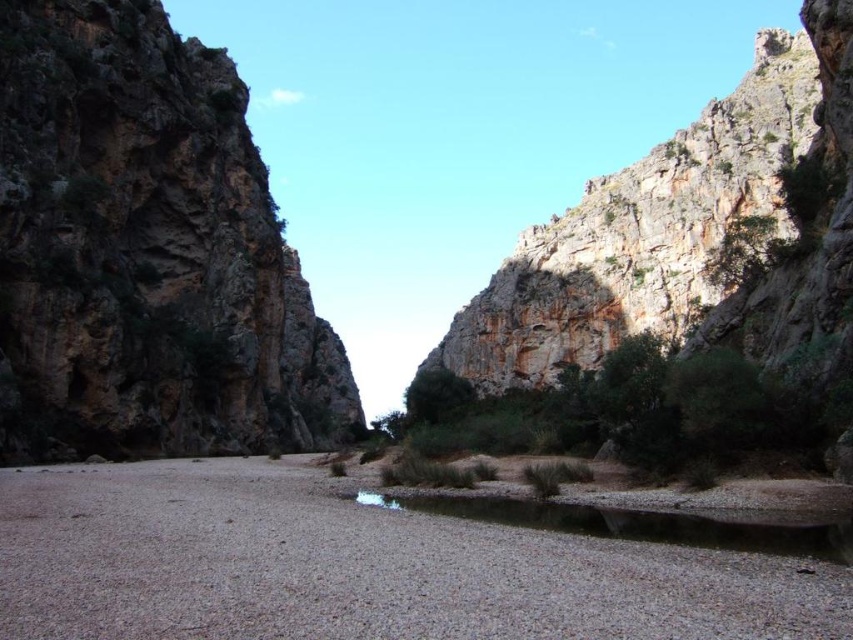
Is point (248, 579) more distant than point (735, 529)?

No.

Is gray gravel bed at center shorter than clear gravel river at center?

Incorrect, gray gravel bed at center's height does not fall short of clear gravel river at center's.

Who is more forward, (x=490, y=557) or (x=584, y=508)?

Point (x=490, y=557) is in front.

The image size is (853, 640). What are the coordinates of `gray gravel bed at center` in the screenshot? It's located at (357, 566).

Which is above, rugged rock mountain at upper right or clear gravel river at center?

rugged rock mountain at upper right is higher up.

Is rugged rock mountain at upper right closer to camera compared to clear gravel river at center?

No.

You are a GUI agent. You are given a task and a screenshot of the screen. Output one action in this format:
    pyautogui.click(x=<x>, y=<y>)
    Task: Click on the rugged rock mountain at upper right
    
    Given the screenshot: What is the action you would take?
    pyautogui.click(x=639, y=234)

In order to click on rugged rock mountain at upper right in this screenshot , I will do `click(639, 234)`.

Which is below, rustic rock mountain at left or rugged rock mountain at upper right?

rustic rock mountain at left

Is point (68, 61) positioned after point (500, 282)?

No, (68, 61) is in front of (500, 282).

This screenshot has height=640, width=853. Find the location of `rustic rock mountain at left`. rustic rock mountain at left is located at coordinates (144, 252).